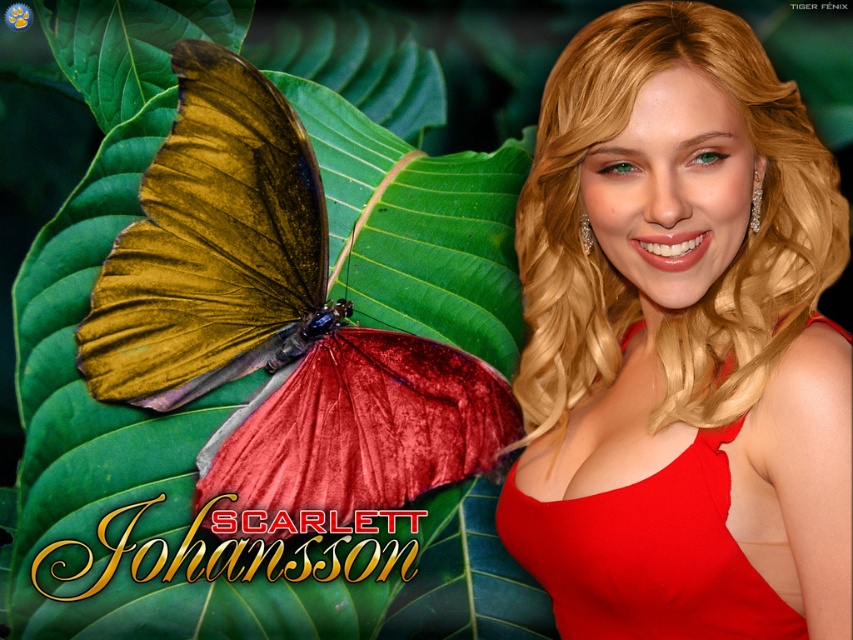
Question: Which object appears closest to the camera in this image?

Choices:
 (A) matte red dress at right
 (B) shiny metallic butterfly at center-left

Answer: (A)

Question: Is shiny metallic butterfly at center-left further to camera compared to matte red dress at right?

Choices:
 (A) no
 (B) yes

Answer: (B)

Question: Can you confirm if shiny metallic butterfly at center-left is positioned to the left of matte red dress at right?

Choices:
 (A) no
 (B) yes

Answer: (B)

Question: In this image, where is shiny metallic butterfly at center-left located relative to matte red dress at right?

Choices:
 (A) right
 (B) left

Answer: (B)